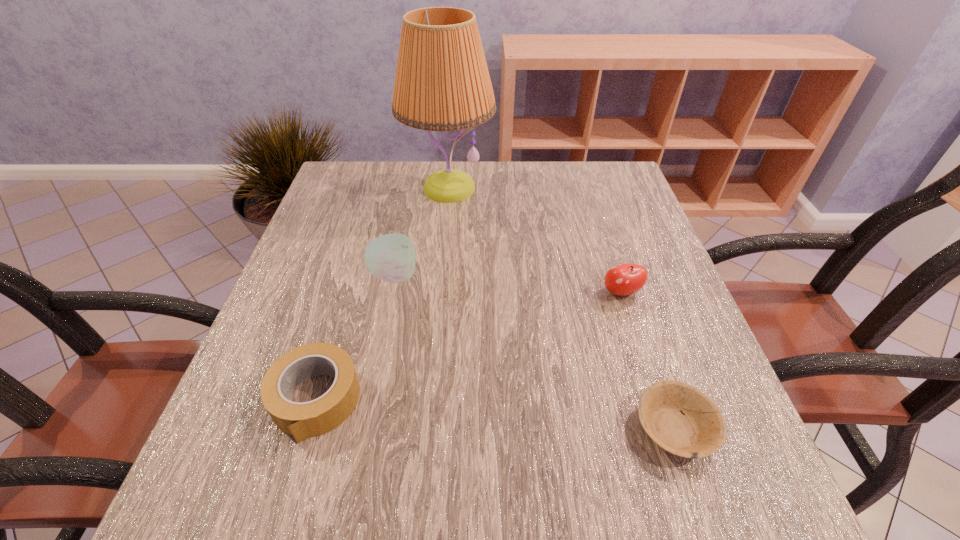
I want to click on vacant space situated on the back of the third shortest object, so click(x=604, y=239).

Locate an element on the screen. The height and width of the screenshot is (540, 960). vacant point located 0.350m on the left of the shortest object is located at coordinates (409, 428).

The width and height of the screenshot is (960, 540). I want to click on object positioned at the far edge, so click(442, 83).

I want to click on object located at the near edge, so click(x=698, y=431).

Identify the location of object situated at the left edge. (302, 420).

Identify the location of apple present at the right edge. The width and height of the screenshot is (960, 540). (624, 279).

The image size is (960, 540). I want to click on bowl located in the right edge section of the desktop, so click(x=698, y=431).

At what (x,y) coordinates should I click in order to perform the action: click on object at the near right corner. Please return your answer as a coordinate pair (x, y). This screenshot has width=960, height=540. Looking at the image, I should click on (698, 431).

The image size is (960, 540). I want to click on vacant space at the far edge of the desktop, so click(x=524, y=204).

Identify the location of free region at the near edge of the desktop. The height and width of the screenshot is (540, 960). (405, 470).